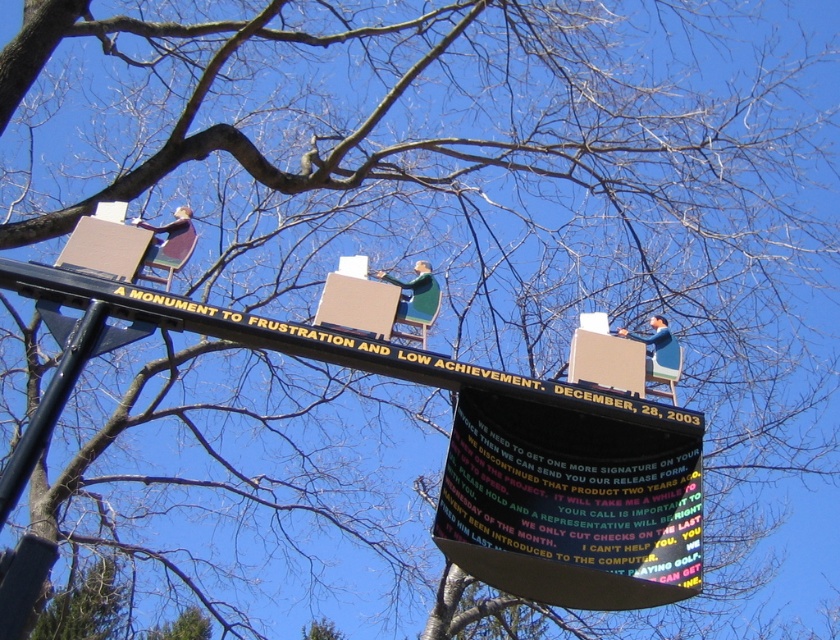
Is point (634, 481) behind point (0, 273)?

Yes, it is.

Is black plastic sign at center closer to camera compared to black painted wood signboard at center?

That is True.

Who is more distant from viewer, (531, 566) or (701, 416)?

Positioned behind is point (701, 416).

Locate an element on the screen. Image resolution: width=840 pixels, height=640 pixels. black plastic sign at center is located at coordinates (570, 506).